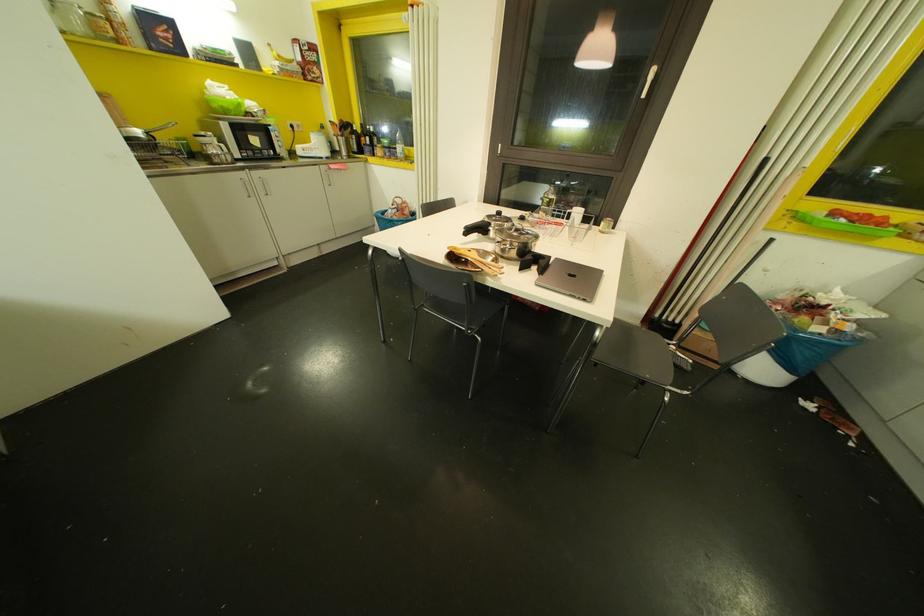
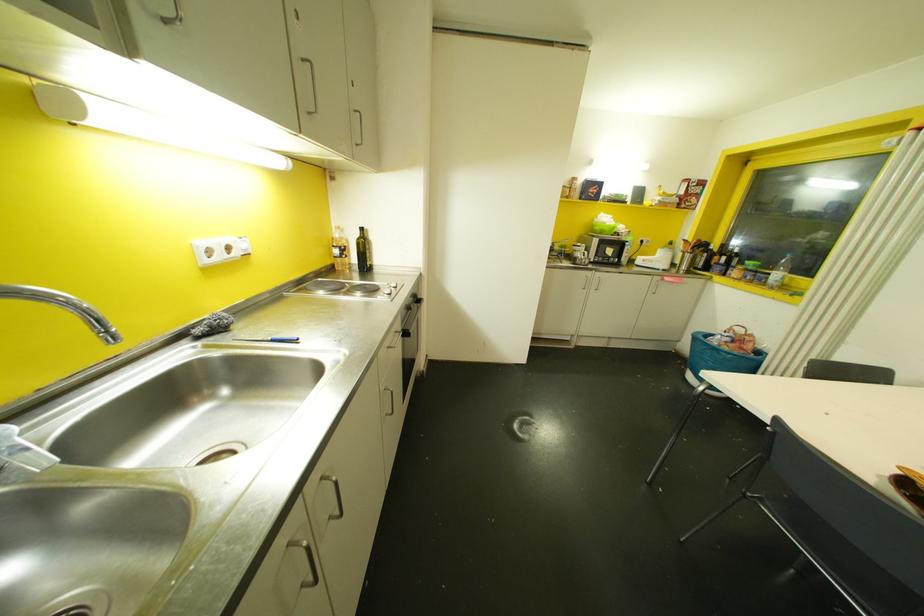
Question: The camera is either moving clockwise (left) or counter-clockwise (right) around the object. The first image is from the beginning of the video and the second image is from the end. Is the camera moving left or right when shooting the video?

Choices:
 (A) Left
 (B) Right

Answer: (B)